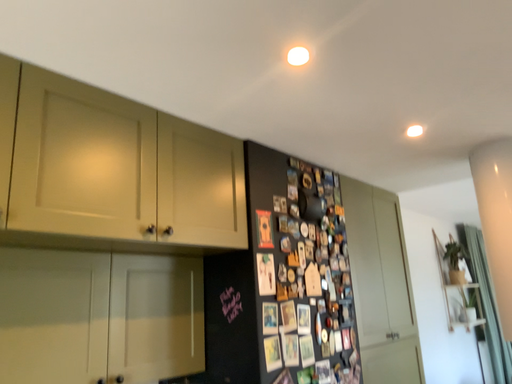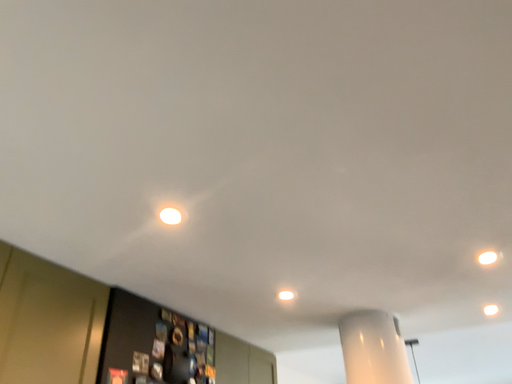
Question: How did the camera likely rotate when shooting the video?

Choices:
 (A) rotated left
 (B) rotated right

Answer: (B)